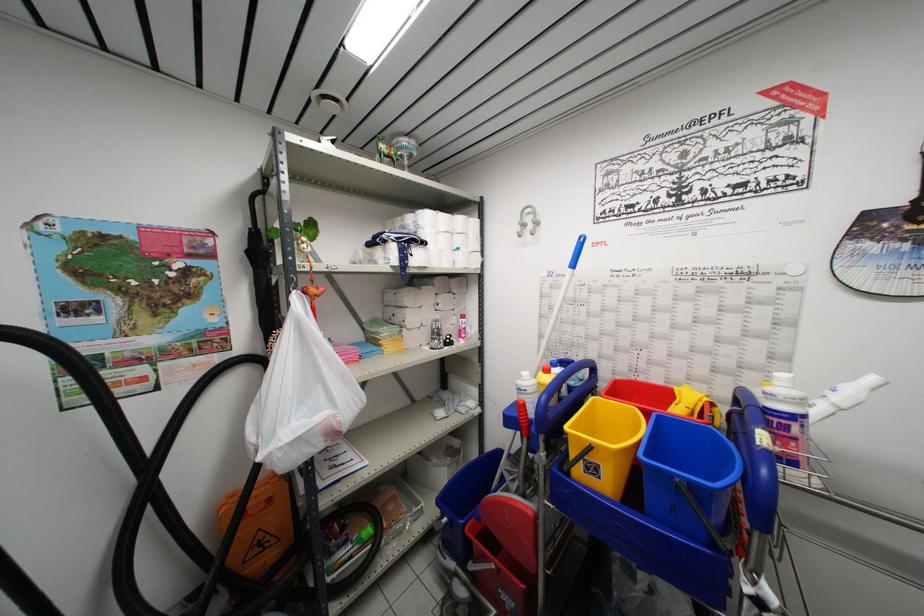
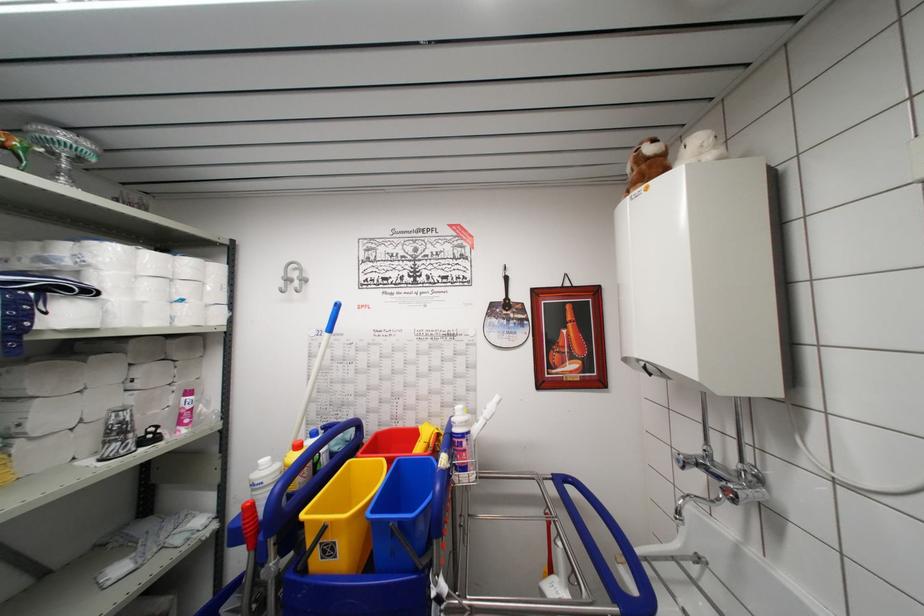
The point at (407, 146) is marked in the first image. Where is the corresponding point in the second image?

(67, 140)